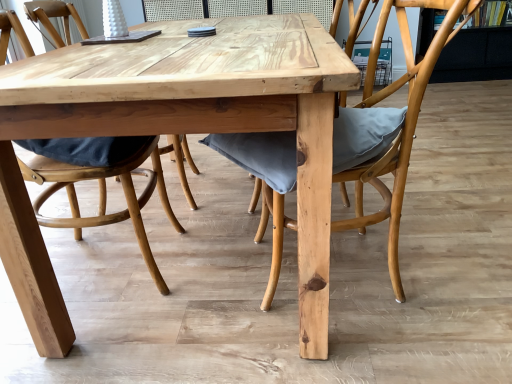
Locate an element on the screen. Image resolution: width=512 pixels, height=384 pixels. vacant space underneath matte wood chair at center, acting as the second chair starting from the right (from a real-world perspective) is located at coordinates (78, 255).